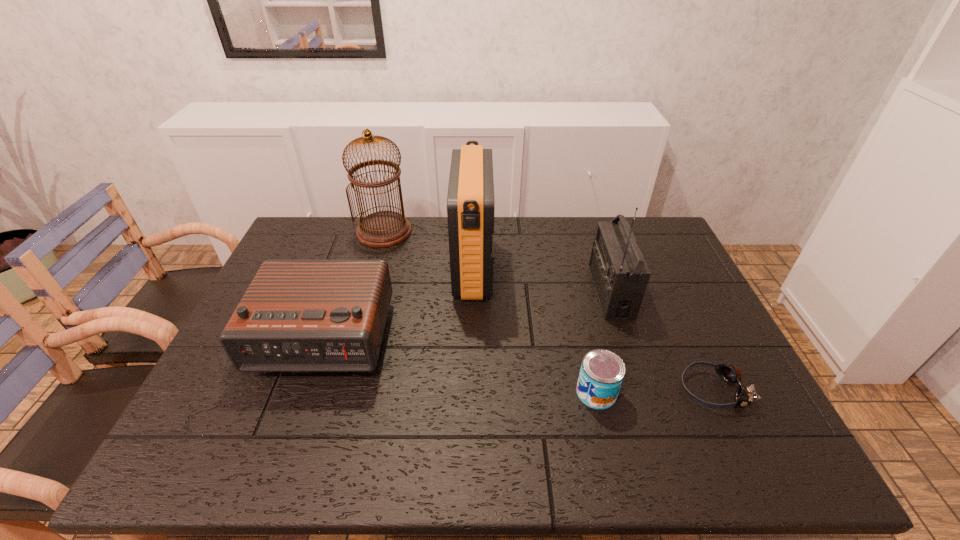
Locate which radio receiver is the closest to the second radio receiver from right to left. Please provide its 2D coordinates. Your answer should be formatted as a tuple, i.e. [(x, y)], where the tuple contains the x and y coordinates of a point satisfying the conditions above.

[(297, 315)]

Select which radio receiver appears as the second closest to the rightmost radio receiver. Please provide its 2D coordinates. Your answer should be formatted as a tuple, i.e. [(x, y)], where the tuple contains the x and y coordinates of a point satisfying the conditions above.

[(297, 315)]

At what (x,y) coordinates should I click in order to perform the action: click on vacant area that satisfies the following two spatial constraints: 1. on the front-facing side of the third object from left to right; 2. on the front panel of the shortest radio receiver. Please return your answer as a coordinate pair (x, y). This screenshot has width=960, height=540. Looking at the image, I should click on (472, 338).

The width and height of the screenshot is (960, 540). What are the coordinates of `free space that satisfies the following two spatial constraints: 1. on the front-facing side of the second radio receiver from right to left; 2. on the back side of the fourth object from left to right` in the screenshot? It's located at (471, 393).

Find the location of a particular element. The height and width of the screenshot is (540, 960). blank space that satisfies the following two spatial constraints: 1. through the lenses of the goggles; 2. on the front side of the second shortest object is located at coordinates (714, 393).

Identify the location of free space that satisfies the following two spatial constraints: 1. on the front panel of the fifth object from left to right; 2. on the front panel of the third shortest object. (626, 338).

You are a GUI agent. You are given a task and a screenshot of the screen. Output one action in this format:
    pyautogui.click(x=<x>, y=<y>)
    Task: Click on the vacant region that satisfies the following two spatial constraints: 1. through the lenses of the goggles; 2. on the front side of the fourth object from left to right
    This screenshot has height=540, width=960.
    Given the screenshot: What is the action you would take?
    pyautogui.click(x=714, y=393)